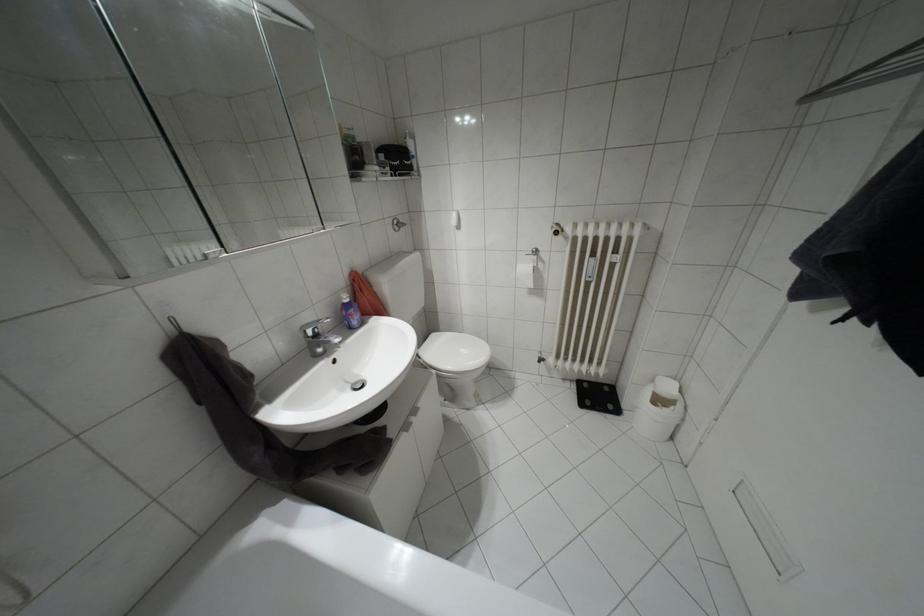
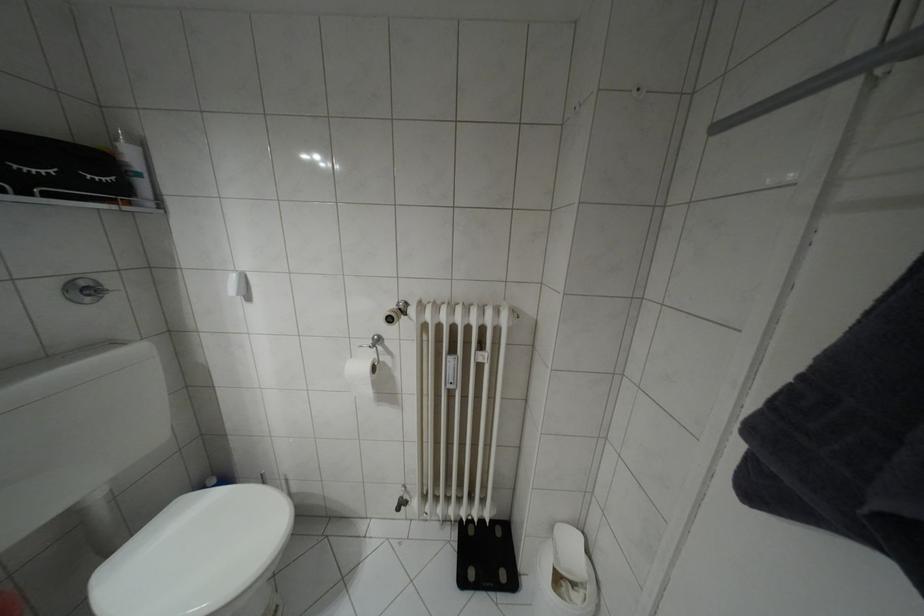
Locate, in the second image, the point that corresponds to [405,138] in the first image.

(116, 139)